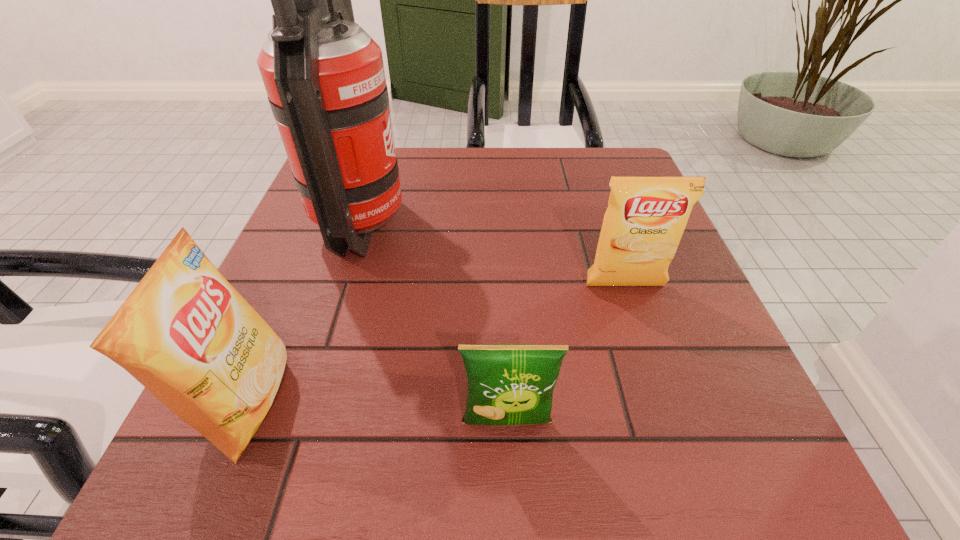
In the image, there is a desktop. Identify the location of vacant space at the right edge. tap(686, 364).

The image size is (960, 540). In order to click on free space at the far right corner of the desktop in this screenshot , I will do `click(602, 187)`.

Locate an element on the screen. The width and height of the screenshot is (960, 540). free space at the near right corner is located at coordinates (748, 435).

Where is `free spot between the fire extinguisher and the second object from right to left`? The width and height of the screenshot is (960, 540). free spot between the fire extinguisher and the second object from right to left is located at coordinates (435, 323).

At what (x,y) coordinates should I click in order to perform the action: click on vacant area between the tallest object and the shortest crisp (potato chip). Please return your answer as a coordinate pair (x, y). The height and width of the screenshot is (540, 960). Looking at the image, I should click on pos(435,323).

Find the location of a particular element. free point between the shortest crisp (potato chip) and the farthest object is located at coordinates (435, 323).

At what (x,y) coordinates should I click in order to perform the action: click on unoccupied position between the second object from right to left and the leftmost crisp (potato chip). Please return your answer as a coordinate pair (x, y). Looking at the image, I should click on (377, 411).

Identify the location of vacant area that lies between the farthest object and the leftmost crisp (potato chip). This screenshot has height=540, width=960. (305, 313).

Locate an element on the screen. The image size is (960, 540). vacant area that lies between the farthest object and the rightmost crisp (potato chip) is located at coordinates (494, 255).

Find the location of a particular element. The width and height of the screenshot is (960, 540). free space between the third nearest object and the leftmost crisp (potato chip) is located at coordinates pos(437,344).